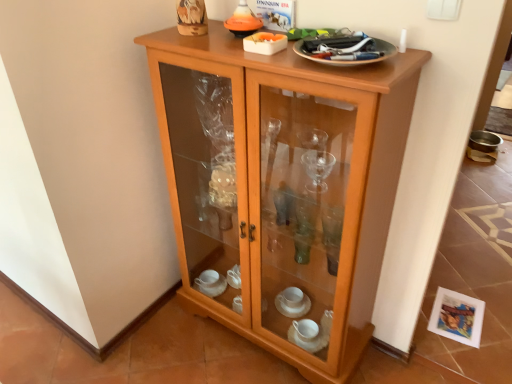
Question: Is metallic silver plate at upper right situated inside light wood/glass cupboard at center or outside?

Choices:
 (A) outside
 (B) inside

Answer: (A)

Question: Considering the positions of point (379, 46) and point (291, 86), is point (379, 46) closer or farther from the camera than point (291, 86)?

Choices:
 (A) closer
 (B) farther

Answer: (B)

Question: Is metallic silver plate at upper right in front of or behind light wood/glass cupboard at center in the image?

Choices:
 (A) behind
 (B) front

Answer: (A)

Question: Considering the positions of light wood/glass cupboard at center and metallic silver plate at upper right in the image, is light wood/glass cupboard at center bigger or smaller than metallic silver plate at upper right?

Choices:
 (A) small
 (B) big

Answer: (B)

Question: Would you say light wood/glass cupboard at center is inside or outside metallic silver plate at upper right?

Choices:
 (A) outside
 (B) inside

Answer: (A)

Question: From their relative heights in the image, would you say light wood/glass cupboard at center is taller or shorter than metallic silver plate at upper right?

Choices:
 (A) tall
 (B) short

Answer: (A)

Question: From a real-world perspective, relative to metallic silver plate at upper right, is light wood/glass cupboard at center vertically above or below?

Choices:
 (A) below
 (B) above

Answer: (A)